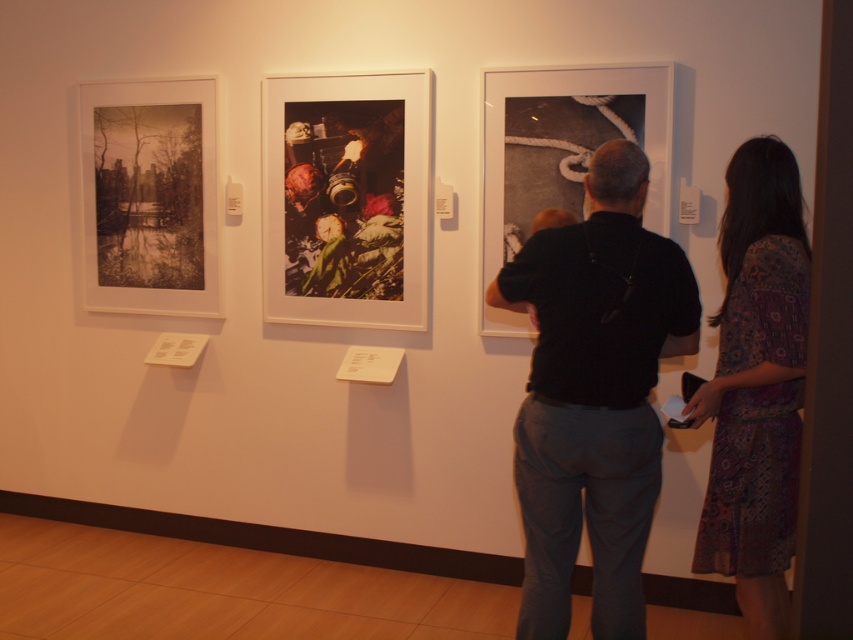
Question: Is black matte shirt at center above printed cotton dress at right?

Choices:
 (A) yes
 (B) no

Answer: (B)

Question: Does printed cotton dress at right lie in front of sepia-toned photograph at left?

Choices:
 (A) no
 (B) yes

Answer: (B)

Question: Can you confirm if printed cotton dress at right is positioned to the right of sepia-toned photograph at left?

Choices:
 (A) no
 (B) yes

Answer: (B)

Question: Among these objects, which one is farthest from the camera?

Choices:
 (A) sepia-toned photograph at left
 (B) black matte shirt at center
 (C) shiny metallic camera at center

Answer: (A)

Question: Which object is the farthest from the printed cotton dress at right?

Choices:
 (A) shiny metallic camera at center
 (B) sepia-toned photograph at left

Answer: (B)

Question: Estimate the real-world distances between objects in this image. Which object is closer to the shiny metallic camera at center?

Choices:
 (A) black matte shirt at center
 (B) printed cotton dress at right

Answer: (A)